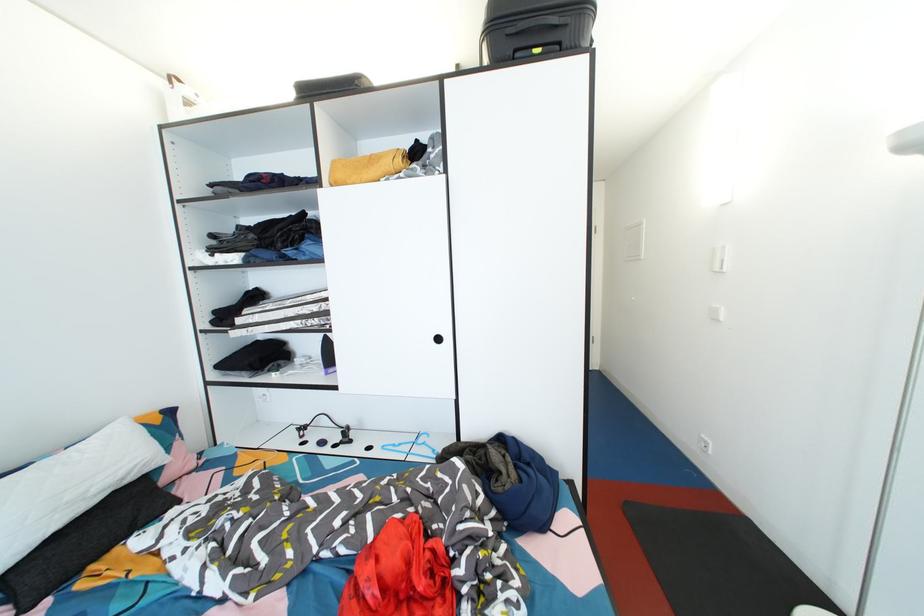
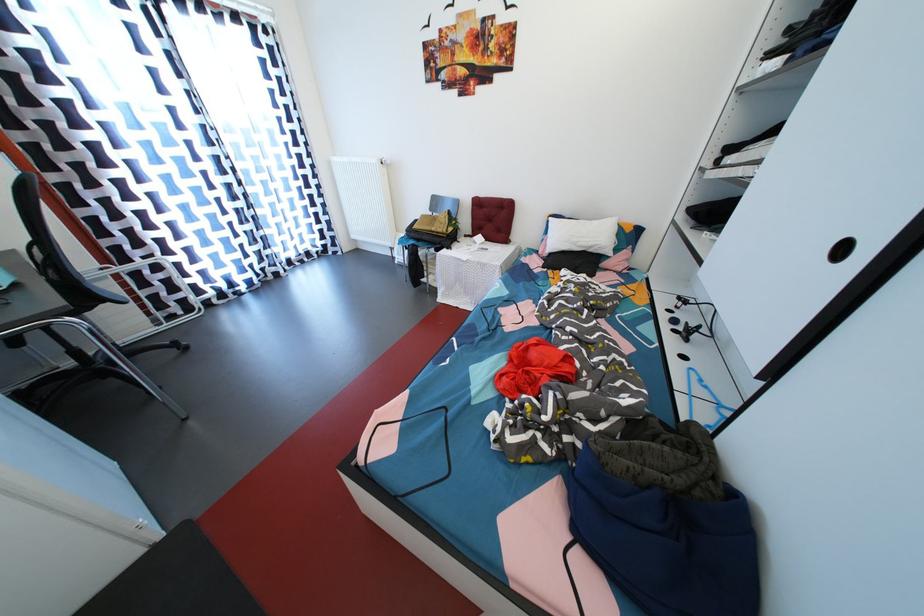
The point at (341, 451) is marked in the first image. Where is the corresponding point in the second image?

(681, 336)